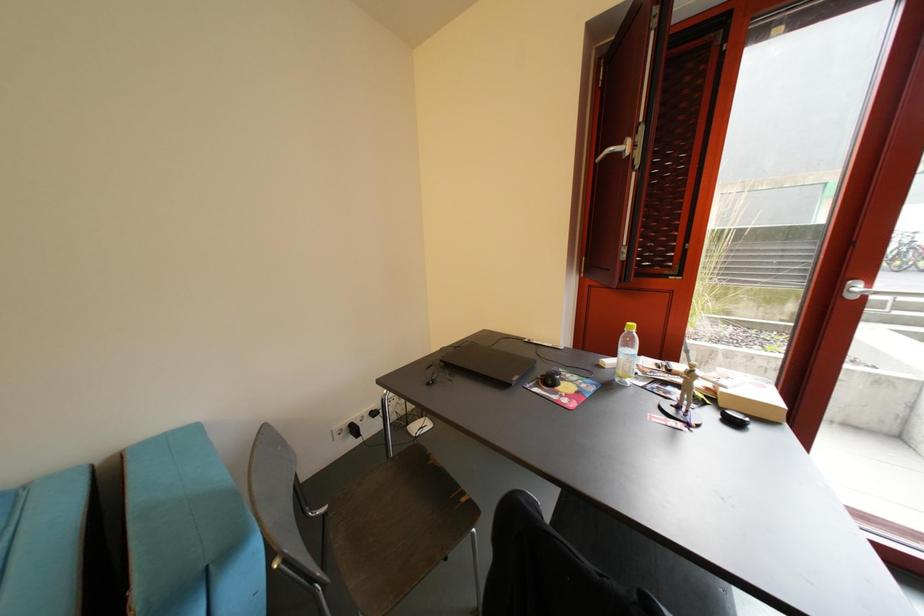
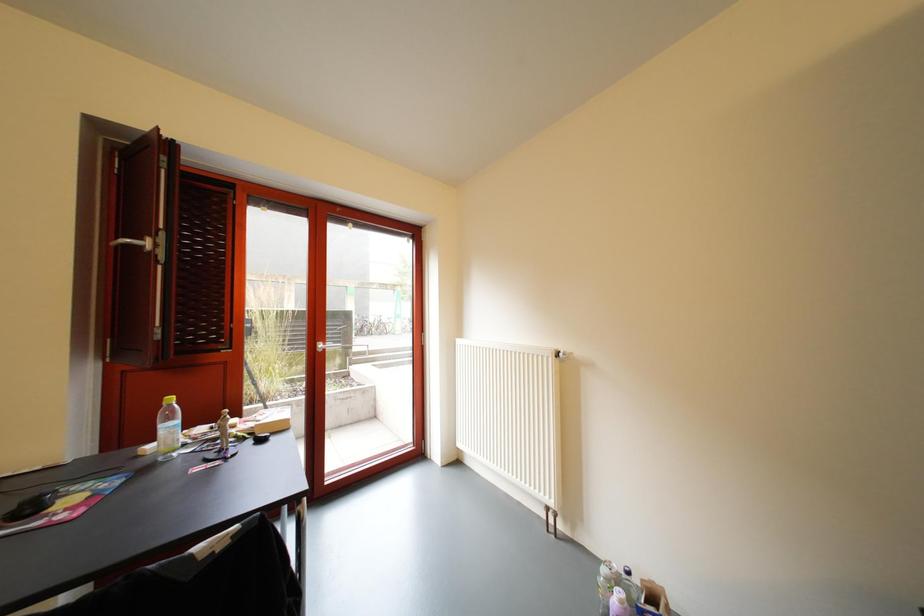
Question: The first image is from the beginning of the video and the second image is from the end. How did the camera likely rotate when shooting the video?

Choices:
 (A) Left
 (B) Right
 (C) Up
 (D) Down

Answer: (B)